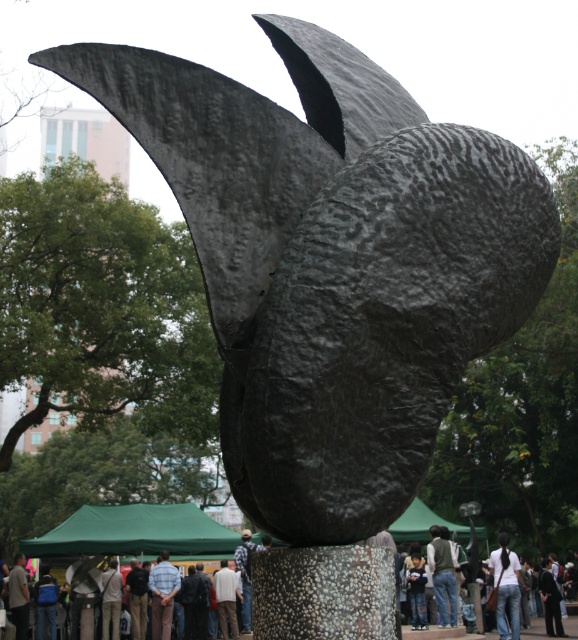
You are an artist planning to paint a portrait of the sculpture. You notice two people in the foreground wearing a dark gray fabric jacket at center and a plaid shirt at center. Since you want to focus on the sculpture, which clothing item should you remove from your painting to minimize visual clutter?

You should remove the plaid shirt at center because it occupies more space than the dark gray fabric jacket at center, thus creating more visual clutter.

You are standing in front of the sculpture and want to place a dark gray fabric jacket at center. Where should you place it?

You should place the dark gray fabric jacket at center at point (442, 576).

Looking at this image, you are standing in front of the sculpture and see two people wearing a light blue shirt at center and a plaid shirt at center. You want to greet both of them. Which direction should you walk first to reach the closest person?

The light blue shirt at center is 4.22 meters away from plaid shirt at center. Since both are at the center, you need to determine which is closer. However, the description only provides the distance between them, not their individual distances from you. Without knowing their exact positions relative to you, it is impossible to determine which is closer. Please provide more information about their positions relative to your current location.